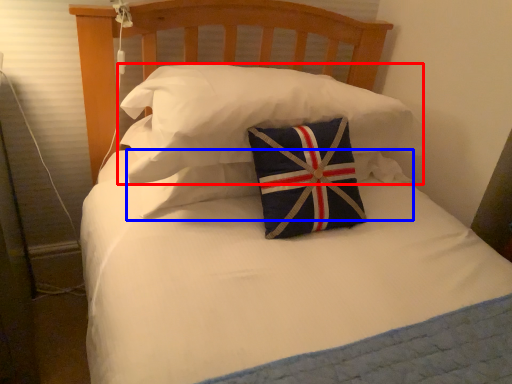
Question: Which point is further to the camera, pillow (highlighted by a red box) or pillow (highlighted by a blue box)?

Choices:
 (A) pillow
 (B) pillow

Answer: (B)